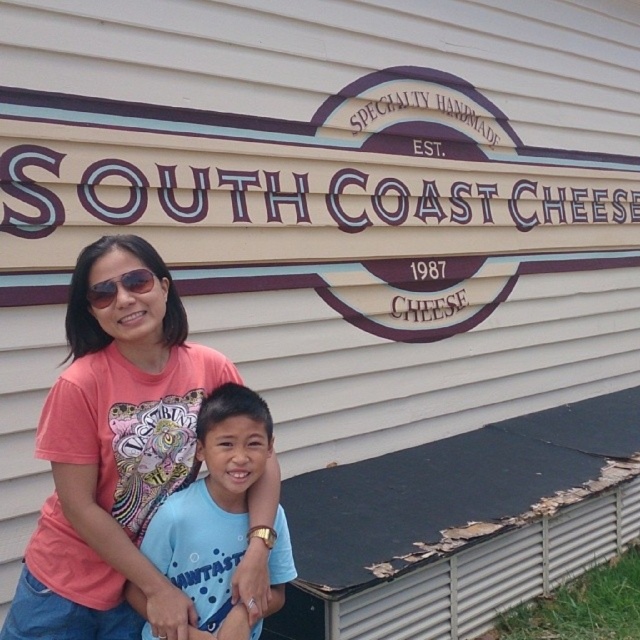
Question: Which object is positioned closest to the blue cotton shirt at center?

Choices:
 (A) black plastic sunglasses at upper center
 (B) pink fabric shirt at center

Answer: (B)

Question: Which point is farther from the camera taking this photo?

Choices:
 (A) tap(147, 536)
 (B) tap(93, 301)

Answer: (A)

Question: Does blue cotton shirt at center have a greater width compared to black plastic sunglasses at upper center?

Choices:
 (A) no
 (B) yes

Answer: (B)

Question: Which object is the farthest from the black plastic sunglasses at upper center?

Choices:
 (A) pink fabric shirt at center
 (B) blue cotton shirt at center

Answer: (B)

Question: Can you confirm if pink fabric shirt at center is wider than blue cotton shirt at center?

Choices:
 (A) no
 (B) yes

Answer: (B)

Question: Does pink fabric shirt at center appear on the left side of blue cotton shirt at center?

Choices:
 (A) yes
 (B) no

Answer: (A)